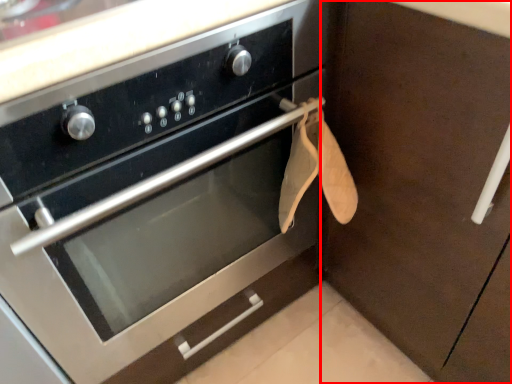
Question: From the image's perspective, where is cabinetry (annotated by the red box) located in relation to oven in the image?

Choices:
 (A) below
 (B) above

Answer: (B)